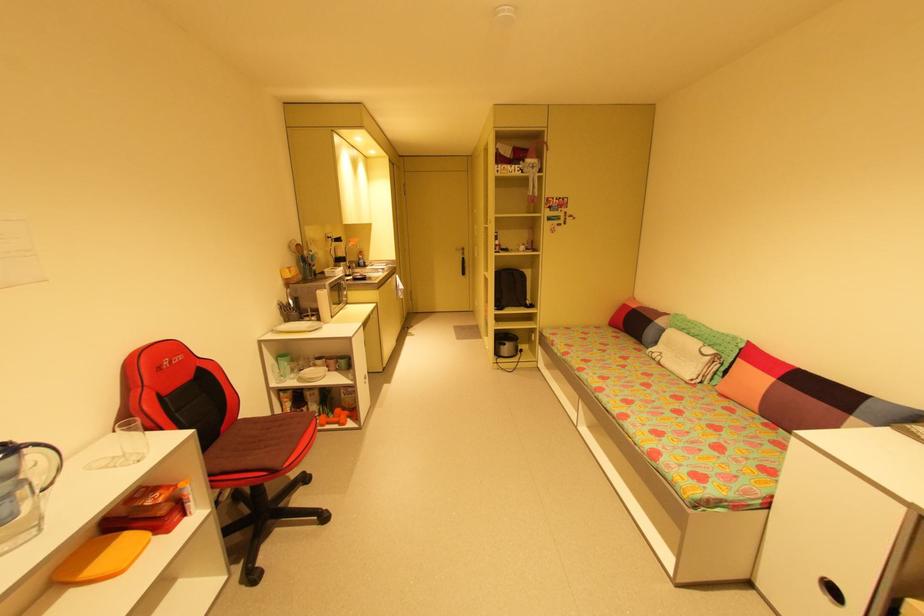
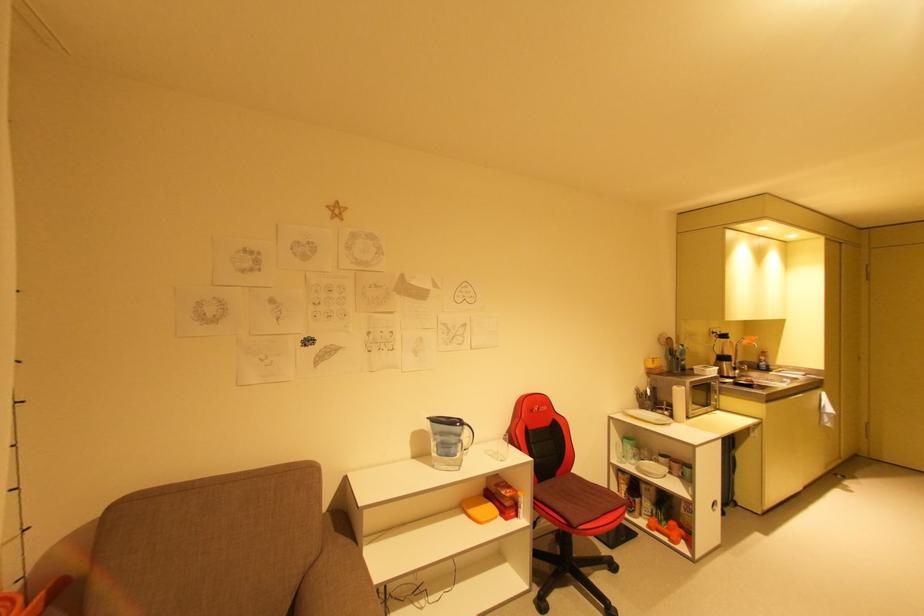
In the second image, find the point that corresponds to point (345, 422) in the first image.

(675, 538)